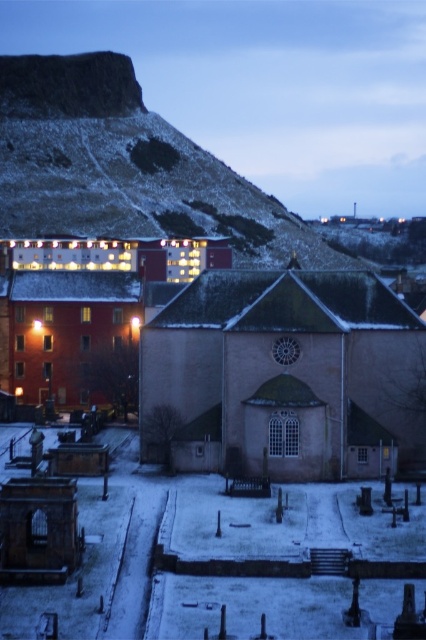
You are an urban planner evaluating the layout of this winter scene. Given the presence of both the smooth stone church at center and the matte brick church at center, which one takes up more area in the image?

The matte brick church at center occupies more space than the smooth stone church at center.

You are standing in the winter scene and want to take a photo of both the smooth stone church at center and the matte brick church at center. Which one will appear larger in your photo?

The smooth stone church at center will appear larger in the photo because it is closer to the viewer than the matte brick church at center.

You are standing at the entrance of the smooth stone church at center. You want to walk directly towards the modern residential building with a reddish brown facade located to the left of the church. Which direction should you face to walk towards the building?

Since the modern residential building with a reddish brown facade is located to the left of the smooth stone church at center, you should face to the left direction to walk towards the building.